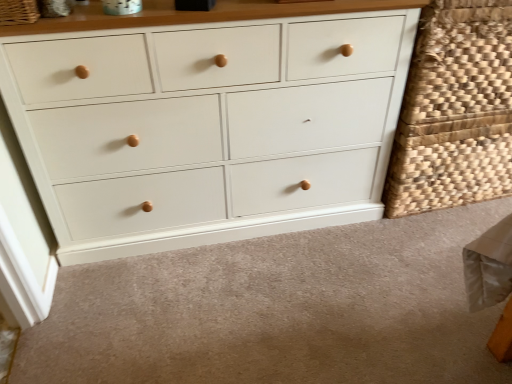
Question: From the image's perspective, is white matte drawer at lower center above white painted wood chest of drawers at center?

Choices:
 (A) no
 (B) yes

Answer: (A)

Question: Can you confirm if white matte drawer at lower center is shorter than white painted wood chest of drawers at center?

Choices:
 (A) no
 (B) yes

Answer: (B)

Question: Considering the relative sizes of white matte drawer at lower center and white painted wood chest of drawers at center in the image provided, is white matte drawer at lower center wider than white painted wood chest of drawers at center?

Choices:
 (A) no
 (B) yes

Answer: (B)

Question: Does white matte drawer at lower center have a greater height compared to white painted wood chest of drawers at center?

Choices:
 (A) yes
 (B) no

Answer: (B)

Question: From a real-world perspective, is white matte drawer at lower center on top of white painted wood chest of drawers at center?

Choices:
 (A) no
 (B) yes

Answer: (A)

Question: In the image, is woven natural basket at right, which is counted as the second basket, starting from the front, on the left side or the right side of white painted wood chest of drawers at center?

Choices:
 (A) right
 (B) left

Answer: (A)

Question: From the image's perspective, is woven natural basket at right, marked as the 1th basket in a right-to-left arrangement, positioned above or below white painted wood chest of drawers at center?

Choices:
 (A) above
 (B) below

Answer: (B)

Question: Is woven natural basket at right, which is the 1th basket from back to front, in front of or behind white painted wood chest of drawers at center in the image?

Choices:
 (A) behind
 (B) front

Answer: (A)

Question: In terms of size, does woven natural basket at right, which is counted as the second basket, starting from the front, appear bigger or smaller than white painted wood chest of drawers at center?

Choices:
 (A) small
 (B) big

Answer: (A)

Question: From a real-world perspective, relative to woven natural basket at right, which is the 1th basket from back to front, is white matte drawer at lower center vertically above or below?

Choices:
 (A) below
 (B) above

Answer: (A)

Question: From their relative heights in the image, would you say white matte drawer at lower center is taller or shorter than woven natural basket at right, marked as the 1th basket in a right-to-left arrangement?

Choices:
 (A) short
 (B) tall

Answer: (A)

Question: Is white matte drawer at lower center wider or thinner than woven natural basket at right, marked as the 1th basket in a right-to-left arrangement?

Choices:
 (A) wide
 (B) thin

Answer: (A)

Question: From the image's perspective, is white matte drawer at lower center above or below woven natural basket at right, which is the 1th basket from back to front?

Choices:
 (A) below
 (B) above

Answer: (A)

Question: Is woven natural fiber basket at upper left, positioned as the 1th basket in front-to-back order, taller or shorter than woven natural basket at right, which is the 1th basket from back to front?

Choices:
 (A) short
 (B) tall

Answer: (A)

Question: From the image's perspective, relative to woven natural basket at right, marked as the 1th basket in a right-to-left arrangement, is woven natural fiber basket at upper left, acting as the 2th basket starting from the back, above or below?

Choices:
 (A) below
 (B) above

Answer: (B)